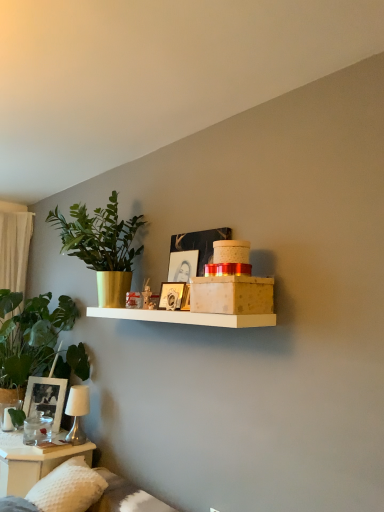
Question: Considering the relative positions of matte glass photo frame at lower left, arranged as the 2th picture frame when viewed from the top, and white textured pillow at lower left in the image provided, is matte glass photo frame at lower left, arranged as the 2th picture frame when viewed from the top, behind white textured pillow at lower left?

Choices:
 (A) no
 (B) yes

Answer: (B)

Question: Is matte glass photo frame at lower left, which is counted as the first picture frame, starting from the back, turned away from white textured pillow at lower left?

Choices:
 (A) no
 (B) yes

Answer: (A)

Question: From the image's perspective, is matte glass photo frame at lower left, placed as the second picture frame when sorted from right to left, beneath white textured pillow at lower left?

Choices:
 (A) no
 (B) yes

Answer: (A)

Question: Does matte glass photo frame at lower left, which is counted as the first picture frame, starting from the back, have a larger size compared to white textured pillow at lower left?

Choices:
 (A) no
 (B) yes

Answer: (A)

Question: Does matte glass photo frame at lower left, arranged as the second picture frame when viewed from the front, touch white textured pillow at lower left?

Choices:
 (A) no
 (B) yes

Answer: (A)

Question: Could you tell me if gold metallic pot at left, positioned as the 1th houseplant in top-to-bottom order, is turned towards green leafy plant at left, which is the 1th houseplant from bottom to top?

Choices:
 (A) yes
 (B) no

Answer: (B)

Question: From the image's perspective, is gold metallic pot at left, the second houseplant positioned from the bottom, over green leafy plant at left, the second houseplant viewed from the top?

Choices:
 (A) yes
 (B) no

Answer: (A)

Question: Would you consider gold metallic pot at left, the second houseplant positioned from the bottom, to be distant from green leafy plant at left, which is the 1th houseplant from bottom to top?

Choices:
 (A) yes
 (B) no

Answer: (B)

Question: Is gold metallic pot at left, positioned as the 1th houseplant in top-to-bottom order, taller than green leafy plant at left, the second houseplant viewed from the top?

Choices:
 (A) no
 (B) yes

Answer: (A)

Question: Does gold metallic pot at left, the second houseplant positioned from the bottom, appear on the right side of green leafy plant at left, the second houseplant viewed from the top?

Choices:
 (A) no
 (B) yes

Answer: (B)

Question: Is gold metallic pot at left, positioned as the 1th houseplant in top-to-bottom order, positioned beyond the bounds of green leafy plant at left, which is the 1th houseplant from bottom to top?

Choices:
 (A) yes
 (B) no

Answer: (A)

Question: Considering the relative sizes of metallic silver table lamp at lower left and clear glass water at lower left in the image provided, is metallic silver table lamp at lower left taller than clear glass water at lower left?

Choices:
 (A) no
 (B) yes

Answer: (A)